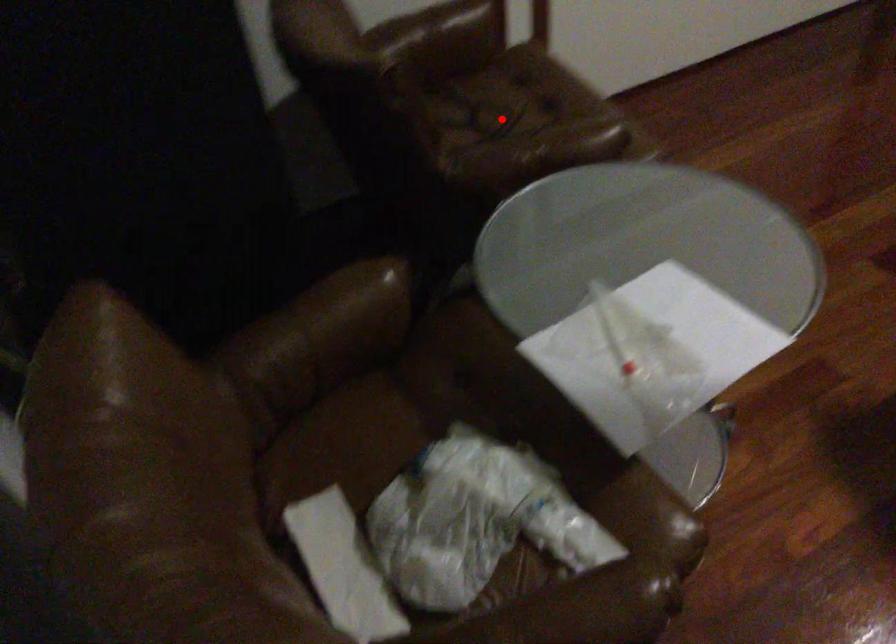
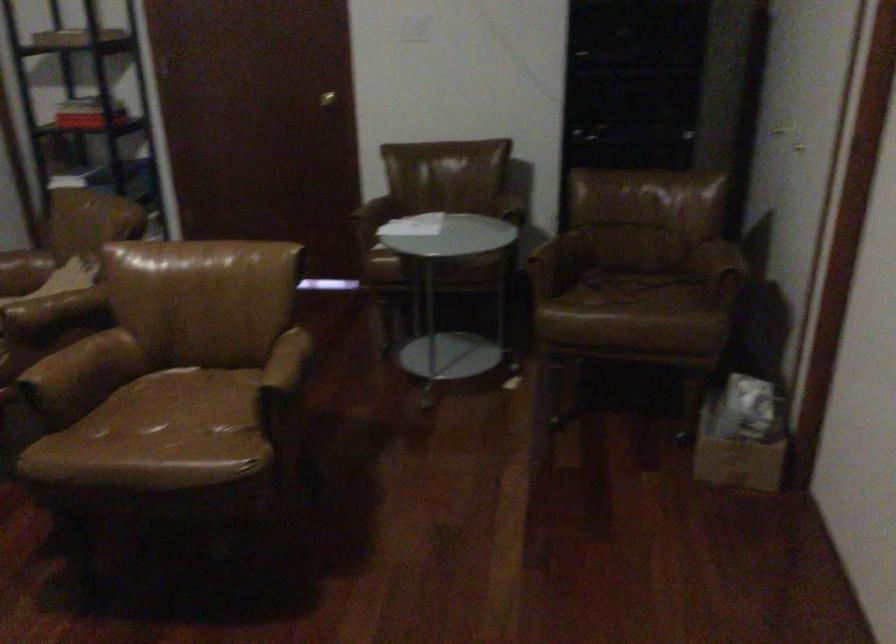
Find the pixel in the second image that matches the highlighted location in the first image.

(627, 288)